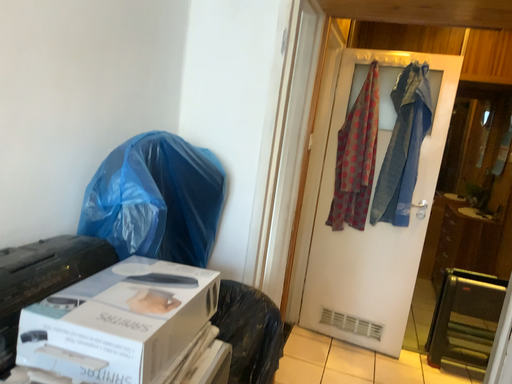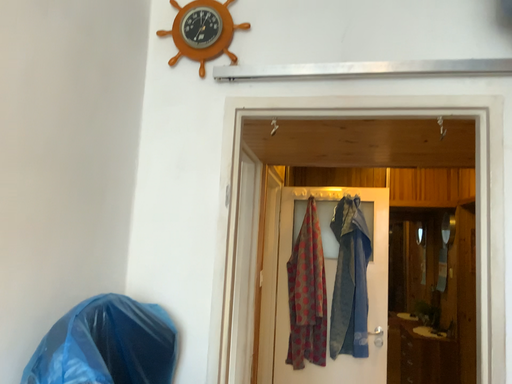
Question: How did the camera likely rotate when shooting the video?

Choices:
 (A) rotated downward
 (B) rotated upward

Answer: (B)